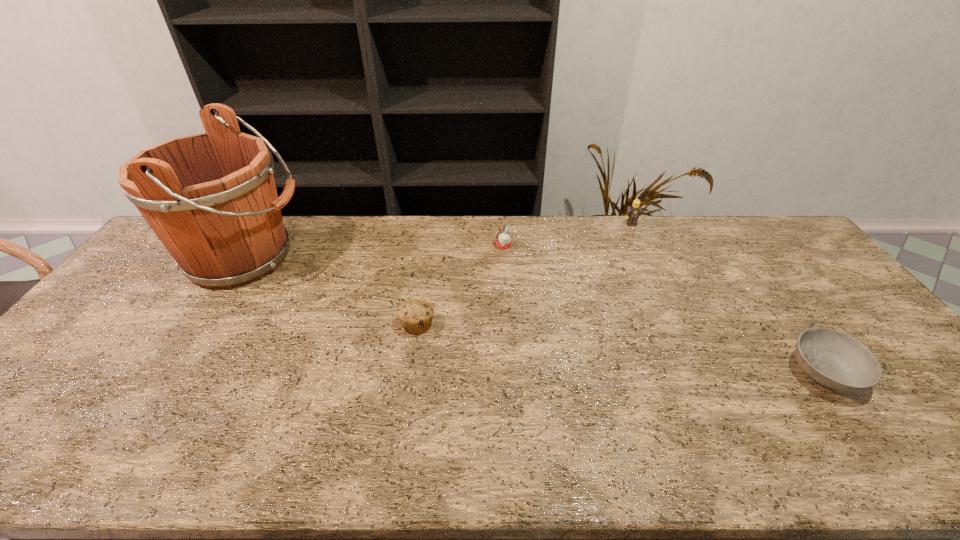
Where is `free space that satisfies the following two spatial constraints: 1. with the handle on the side of the bucket; 2. on the back side of the fourth farthest object`? free space that satisfies the following two spatial constraints: 1. with the handle on the side of the bucket; 2. on the back side of the fourth farthest object is located at coordinates (203, 325).

Image resolution: width=960 pixels, height=540 pixels. I want to click on vacant space that satisfies the following two spatial constraints: 1. on the back side of the second nearest object; 2. with the handle on the side of the tallest object, so click(x=426, y=258).

The height and width of the screenshot is (540, 960). What are the coordinates of `vacant space that satisfies the following two spatial constraints: 1. on the front-facing side of the right muffin; 2. on the left side of the rightmost object` in the screenshot? It's located at (512, 373).

The height and width of the screenshot is (540, 960). I want to click on vacant space that satisfies the following two spatial constraints: 1. on the back side of the bowl; 2. with the handle on the side of the bucket, so click(x=742, y=258).

Identify the location of vacant space that satisfies the following two spatial constraints: 1. with the handle on the side of the nearer muffin; 2. on the right side of the tallest object. Image resolution: width=960 pixels, height=540 pixels. (203, 325).

The image size is (960, 540). I want to click on free region that satisfies the following two spatial constraints: 1. on the front-facing side of the nearest object; 2. on the right side of the third object from right to left, so click(x=512, y=373).

Identify the location of vacant point that satisfies the following two spatial constraints: 1. with the handle on the side of the leftmost object; 2. on the back side of the nearer muffin. (203, 325).